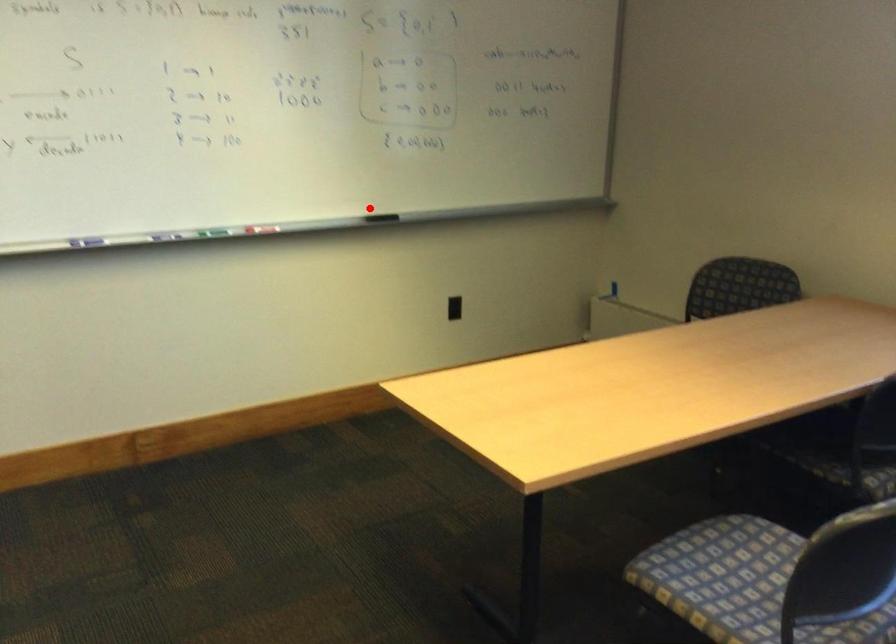
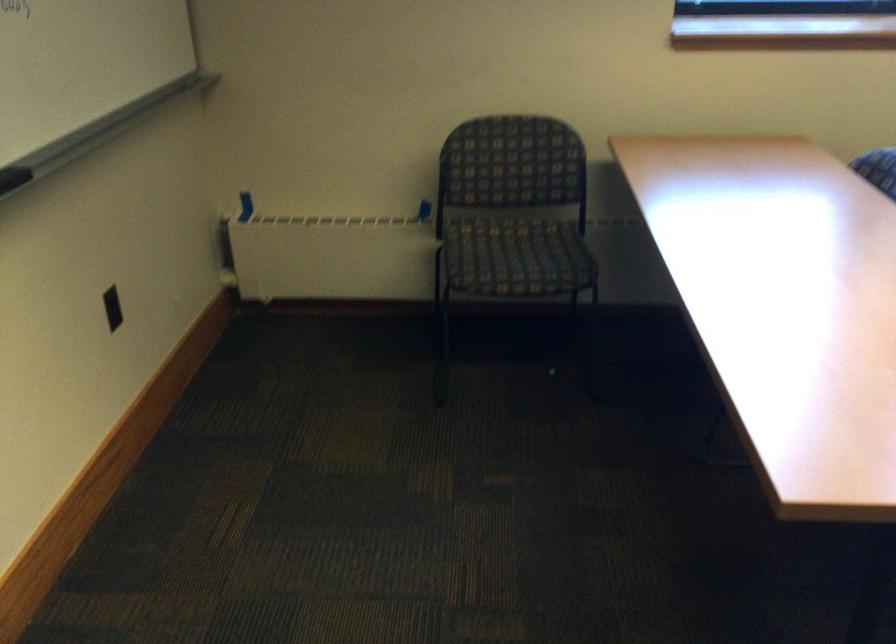
Question: I am providing you with two images of the same scene from different viewpoints. A red point is shown in image1. For the corresponding object point in image2, is it positioned nearer or farther from the camera?

Choices:
 (A) Nearer
 (B) Farther

Answer: (A)